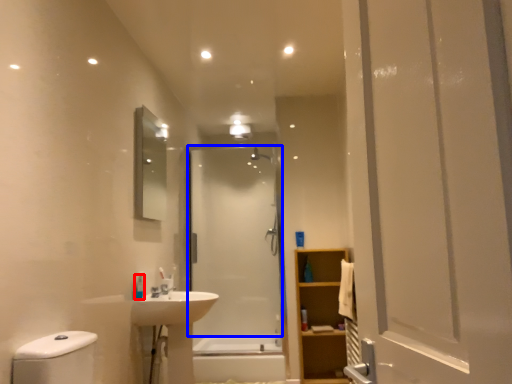
Question: Which object is further to the camera taking this photo, toiletry (highlighted by a red box) or screen door (highlighted by a blue box)?

Choices:
 (A) toiletry
 (B) screen door

Answer: (B)